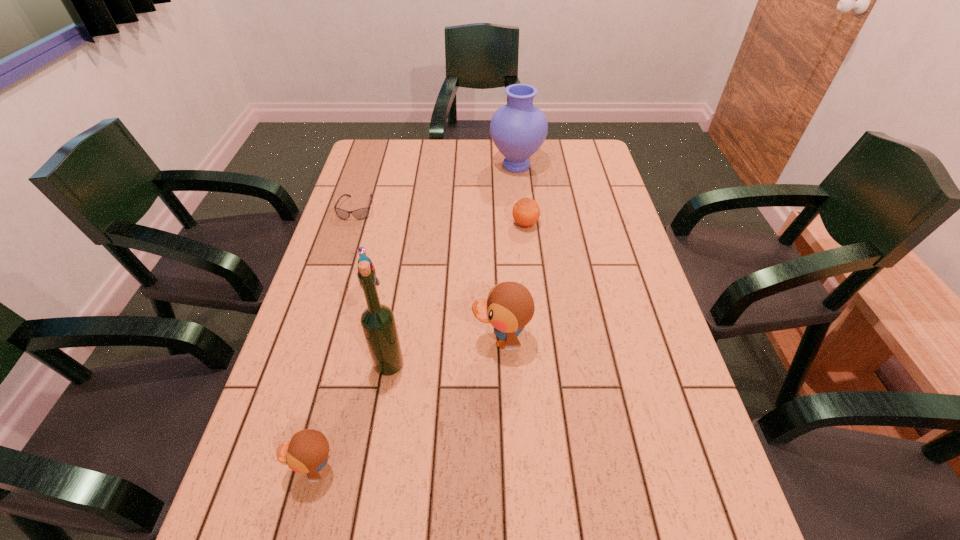
The image size is (960, 540). In order to click on duck present at the left edge in this screenshot , I will do `click(307, 451)`.

Locate an element on the screen. The height and width of the screenshot is (540, 960). sunglasses that is at the left edge is located at coordinates (362, 213).

Identify the location of soda located at the left edge. (361, 251).

This screenshot has height=540, width=960. What are the coordinates of `object that is at the near left corner` in the screenshot? It's located at (307, 451).

Identify the location of blank space at the far edge. (493, 163).

This screenshot has width=960, height=540. In the image, there is a desktop. Find the location of `vacant space at the left edge`. vacant space at the left edge is located at coordinates (273, 434).

In the image, there is a desktop. Identify the location of vacant space at the right edge. This screenshot has height=540, width=960. (629, 267).

I want to click on vacant area that lies between the shortest object and the vase, so click(x=436, y=187).

The width and height of the screenshot is (960, 540). What are the coordinates of `free area in between the right duck and the liquor` in the screenshot? It's located at (445, 352).

The height and width of the screenshot is (540, 960). Identify the location of unoccupied position between the vase and the sunglasses. (436, 187).